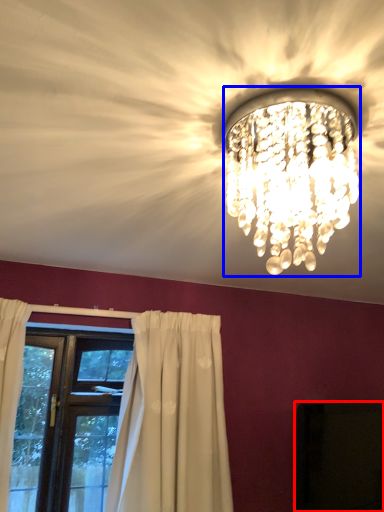
Question: Which of the following is the farthest to the observer, dark (highlighted by a red box) or lamp (highlighted by a blue box)?

Choices:
 (A) dark
 (B) lamp

Answer: (A)